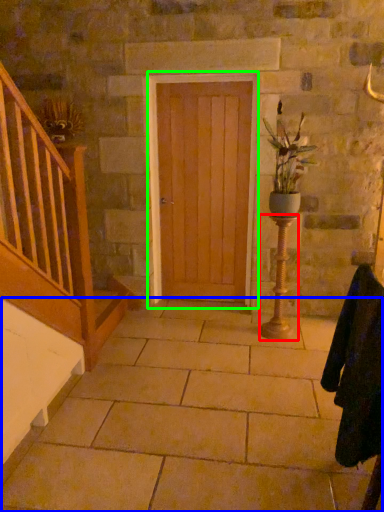
Question: Which object is positioned closest to candle holder (highlighted by a red box)? Select from concrete (highlighted by a blue box) and door (highlighted by a green box).

Choices:
 (A) concrete
 (B) door

Answer: (B)